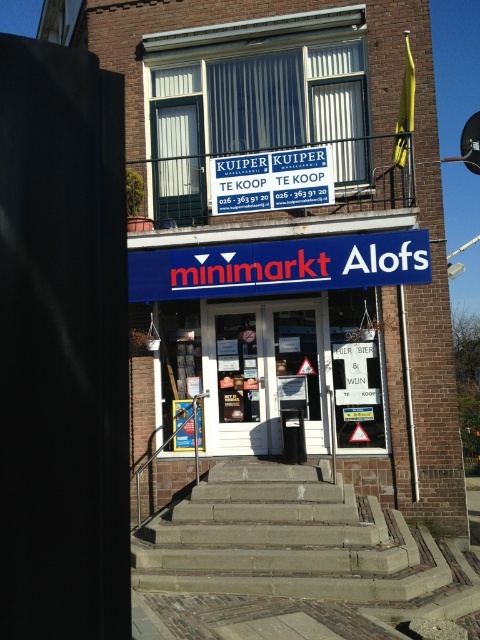
You are a delivery person trying to reach the blue plastic sign at upper center to drop off a package. The brown stone stairs at center are in your way. Can you climb over the stairs to reach the sign?

The brown stone stairs at center has a greater height compared to blue plastic sign at upper center. Since the stairs are taller, you would need to climb them first to reach the sign above.

You are a delivery person trying to park your 1.2 meter wide cart in front of the minimarkt Alofs. The only available space is between the brown stone stairs at center and the blue plastic sign at upper center. Can your cart fit there?

The brown stone stairs at center is wider than the blue plastic sign at upper center. Since the cart is 1.2 meters wide, it depends on the minimum width between them. However, since the stairs are wider, the space might be sufficient. But without exact measurements, we can infer that if the stairs are wider, the gap might be large enough for the cart.

You are a customer entering the minimarkt Alofs and notice the brown stone stairs at center and the blue plastic sign at upper center. Which object is located higher up in the image?

The blue plastic sign at upper center is located higher up in the image than the brown stone stairs at center.